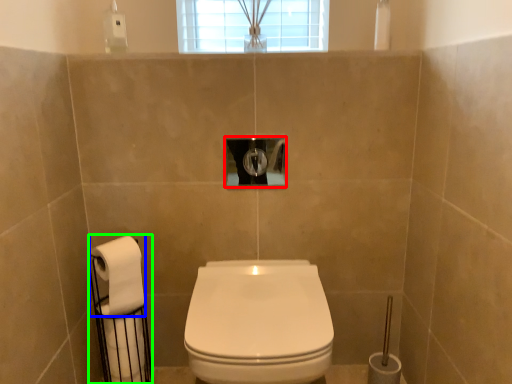
Question: Estimate the real-world distances between objects in this image. Which object is farther from hole (highlighted by a red box), toilet paper (highlighted by a blue box) or toilet paper (highlighted by a green box)?

Choices:
 (A) toilet paper
 (B) toilet paper

Answer: (B)